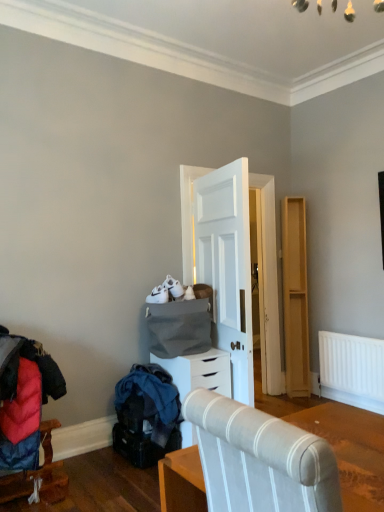
I want to click on textured fabric chair at center, placed as the 1th furniture when sorted from top to bottom, so click(x=259, y=459).

In order to face textured fabric chair at center, acting as the second furniture starting from the bottom, should I rotate leftwards or rightwards?

Turn right by 16.981 degrees to look at textured fabric chair at center, acting as the second furniture starting from the bottom.

Identify the location of light wood dresser at right. The width and height of the screenshot is (384, 512). (295, 296).

What do you see at coordinates (38, 475) in the screenshot? Image resolution: width=384 pixels, height=512 pixels. I see `velvet red coat at lower left, the 2th furniture when ordered from right to left` at bounding box center [38, 475].

Image resolution: width=384 pixels, height=512 pixels. Find the location of `white matte chest of drawers at center`. white matte chest of drawers at center is located at coordinates (199, 371).

Consider the image. Is there a large distance between light wood dresser at right and white matte chest of drawers at center?

Yes.

Considering the sizes of objects light wood dresser at right and white matte chest of drawers at center in the image provided, who is bigger, light wood dresser at right or white matte chest of drawers at center?

white matte chest of drawers at center.

From a real-world perspective, between light wood dresser at right and white matte chest of drawers at center, who is vertically higher?

In real-world perspective, light wood dresser at right is above.

Based on the photo, could you tell me if light wood dresser at right is facing white matte chest of drawers at center?

No, light wood dresser at right does not turn towards white matte chest of drawers at center.

In the scene shown: Is velvet red coat at lower left, the second furniture viewed from the front, far away from textured fabric chair at center, acting as the first furniture starting from the right?

Yes.

Is velvet red coat at lower left, the second furniture viewed from the front, bigger or smaller than textured fabric chair at center, acting as the second furniture starting from the bottom?

Clearly, velvet red coat at lower left, the second furniture viewed from the front, is smaller in size than textured fabric chair at center, acting as the second furniture starting from the bottom.

Can you confirm if velvet red coat at lower left, the 2th furniture when ordered from right to left, is shorter than textured fabric chair at center, acting as the first furniture starting from the right?

Indeed, velvet red coat at lower left, the 2th furniture when ordered from right to left, has a lesser height compared to textured fabric chair at center, acting as the first furniture starting from the right.

Is velvet red coat at lower left, the first furniture in the back-to-front sequence, positioned with its back to textured fabric chair at center, positioned as the first furniture in front-to-back order?

velvet red coat at lower left, the first furniture in the back-to-front sequence, does not have its back to textured fabric chair at center, positioned as the first furniture in front-to-back order.

Considering the sizes of white matte chest of drawers at center and light wood dresser at right in the image, is white matte chest of drawers at center bigger or smaller than light wood dresser at right?

Considering their sizes, white matte chest of drawers at center takes up more space than light wood dresser at right.

This screenshot has width=384, height=512. I want to click on the chest of drawers beneath the light wood dresser at right (from a real-world perspective), so click(x=199, y=371).

Is point (158, 359) positioned before point (291, 324)?

Yes, it is in front of point (291, 324).

Is white matte chest of drawers at center wider than light wood dresser at right?

Yes, white matte chest of drawers at center is wider than light wood dresser at right.

Is velvet red coat at lower left, the first furniture in the back-to-front sequence, completely or partially inside white matte chest of drawers at center?

No, velvet red coat at lower left, the first furniture in the back-to-front sequence, is not inside white matte chest of drawers at center.

Does white matte chest of drawers at center have a larger size compared to velvet red coat at lower left, the first furniture positioned from the left?

Indeed, white matte chest of drawers at center has a larger size compared to velvet red coat at lower left, the first furniture positioned from the left.

From a real-world perspective, who is located lower, white matte chest of drawers at center or velvet red coat at lower left, the first furniture positioned from the left?

From a 3D spatial view, velvet red coat at lower left, the first furniture positioned from the left, is below.

Is velvet red coat at lower left, the second furniture viewed from the front, not within white matte chest of drawers at center?

Absolutely, velvet red coat at lower left, the second furniture viewed from the front, is external to white matte chest of drawers at center.

From a real-world perspective, which object rests below the other?

From a 3D spatial view, velvet red coat at lower left, the first furniture in the back-to-front sequence, is below.

What are the coordinates of `furniture that is below the white matte chest of drawers at center (from the image's perspective)` in the screenshot? It's located at (38, 475).

Which is less distant, (37, 496) or (224, 375)?

Point (37, 496) is positioned closer to the camera compared to point (224, 375).

Is velvet red coat at lower left, which is counted as the second furniture, starting from the top, at the back of textured fabric chair at center, which is the 2th furniture in left-to-right order?

No, textured fabric chair at center, which is the 2th furniture in left-to-right order,'s orientation is not away from velvet red coat at lower left, which is counted as the second furniture, starting from the top.

From the picture: Can you confirm if textured fabric chair at center, acting as the first furniture starting from the right, is positioned to the left of velvet red coat at lower left, the second furniture viewed from the front?

No.

I want to click on furniture located above the velvet red coat at lower left, the first furniture in the back-to-front sequence (from the image's perspective), so click(259, 459).

Between point (313, 478) and point (21, 496), which one is positioned in front?

The point (313, 478) is closer.

From the picture: Would you say light wood dresser at right is inside or outside velvet red coat at lower left, the second furniture viewed from the front?

light wood dresser at right cannot be found inside velvet red coat at lower left, the second furniture viewed from the front.

How far apart are light wood dresser at right and velvet red coat at lower left, the first furniture positioned from the left?

8.77 feet.

Consider the image. Can you confirm if light wood dresser at right is wider than velvet red coat at lower left, the second furniture viewed from the front?

Incorrect, the width of light wood dresser at right does not surpass that of velvet red coat at lower left, the second furniture viewed from the front.

From a real-world perspective, is light wood dresser at right under velvet red coat at lower left, the first furniture positioned from the left?

No, from a real-world perspective, light wood dresser at right is not below velvet red coat at lower left, the first furniture positioned from the left.

I want to click on dresser behind the white matte chest of drawers at center, so click(295, 296).

You are a GUI agent. You are given a task and a screenshot of the screen. Output one action in this format:
    pyautogui.click(x=<x>, y=<y>)
    Task: Click on the furniture below the textured fabric chair at center, placed as the 1th furniture when sorted from top to bottom (from a real-world perspective)
    This screenshot has height=512, width=384.
    Given the screenshot: What is the action you would take?
    pyautogui.click(x=38, y=475)

Considering their positions, is white matte chest of drawers at center positioned closer to velvet red coat at lower left, the first furniture positioned from the left, than textured fabric chair at center, acting as the second furniture starting from the bottom?

The object closer to velvet red coat at lower left, the first furniture positioned from the left, is white matte chest of drawers at center.

From the picture: Estimate the real-world distances between objects in this image. Which object is closer to velvet red coat at lower left, the first furniture in the back-to-front sequence, light wood dresser at right or textured fabric chair at center, acting as the first furniture starting from the right?

Based on the image, textured fabric chair at center, acting as the first furniture starting from the right, appears to be nearer to velvet red coat at lower left, the first furniture in the back-to-front sequence.

From the image, which object appears to be nearer to textured fabric chair at center, positioned as the first furniture in front-to-back order, white matte chest of drawers at center or light wood dresser at right?

Based on the image, white matte chest of drawers at center appears to be nearer to textured fabric chair at center, positioned as the first furniture in front-to-back order.

Estimate the real-world distances between objects in this image. Which object is further from white matte chest of drawers at center, velvet red coat at lower left, the first furniture in the back-to-front sequence, or light wood dresser at right?

light wood dresser at right lies further to white matte chest of drawers at center than the other object.

When comparing their distances from white matte chest of drawers at center, does light wood dresser at right or textured fabric chair at center, the second furniture from the back, seem further?

textured fabric chair at center, the second furniture from the back, is further to white matte chest of drawers at center.

Looking at the image, which one is located further to white matte chest of drawers at center, textured fabric chair at center, acting as the first furniture starting from the right, or velvet red coat at lower left, which is counted as the second furniture, starting from the top?

The object further to white matte chest of drawers at center is textured fabric chair at center, acting as the first furniture starting from the right.

From the image, which object appears to be farther from textured fabric chair at center, which is the 2th furniture in left-to-right order, white matte chest of drawers at center or velvet red coat at lower left, acting as the 1th furniture starting from the bottom?

white matte chest of drawers at center is positioned further to the anchor textured fabric chair at center, which is the 2th furniture in left-to-right order.

Looking at the image, which one is located further to light wood dresser at right, white matte chest of drawers at center or textured fabric chair at center, acting as the second furniture starting from the bottom?

Among the two, textured fabric chair at center, acting as the second furniture starting from the bottom, is located further to light wood dresser at right.

Locate an element on the screen. The image size is (384, 512). chest of drawers between textured fabric chair at center, which is the 2th furniture in left-to-right order, and light wood dresser at right, along the z-axis is located at coordinates [x=199, y=371].

Where is `furniture positioned between textured fabric chair at center, the second furniture from the back, and white matte chest of drawers at center from near to far`? This screenshot has height=512, width=384. furniture positioned between textured fabric chair at center, the second furniture from the back, and white matte chest of drawers at center from near to far is located at coordinates (38, 475).

At what (x,y) coordinates should I click in order to perform the action: click on furniture between textured fabric chair at center, which is the 2th furniture in left-to-right order, and light wood dresser at right, along the z-axis. Please return your answer as a coordinate pair (x, y). Looking at the image, I should click on (38, 475).

Find the location of a particular element. chest of drawers between velvet red coat at lower left, the first furniture positioned from the left, and light wood dresser at right, in the horizontal direction is located at coordinates (199, 371).